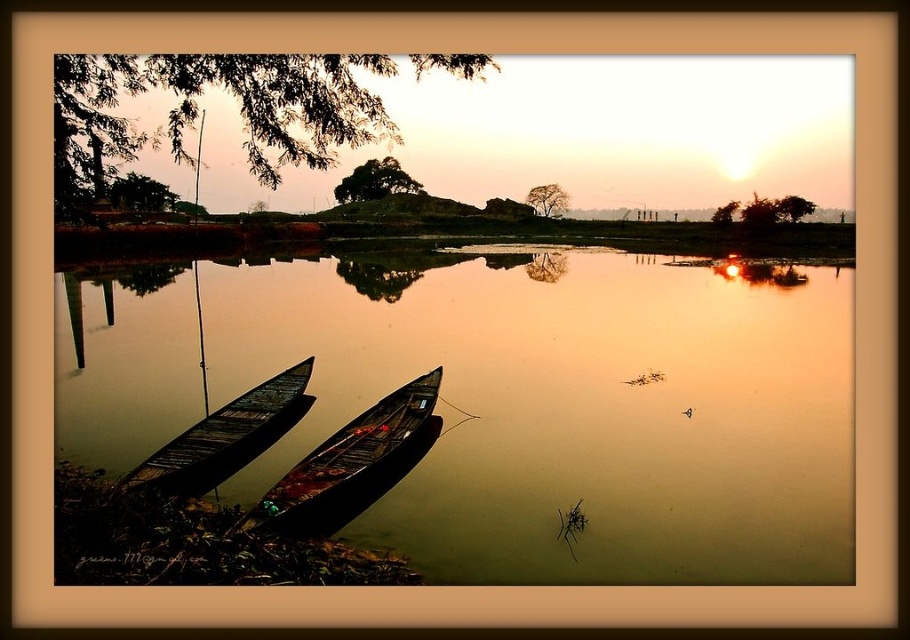
Question: Is wooden canoe at center closer to camera compared to dark wood canoe at lower left?

Choices:
 (A) yes
 (B) no

Answer: (A)

Question: Among these objects, which one is nearest to the camera?

Choices:
 (A) brown wooden river at center
 (B) dark wood canoe at lower left
 (C) wooden canoe at center

Answer: (A)

Question: Among these objects, which one is farthest from the camera?

Choices:
 (A) brown wooden river at center
 (B) wooden canoe at center

Answer: (B)

Question: Does wooden canoe at center appear under dark wood canoe at lower left?

Choices:
 (A) yes
 (B) no

Answer: (A)

Question: Is brown wooden river at center thinner than dark wood canoe at lower left?

Choices:
 (A) yes
 (B) no

Answer: (B)

Question: Which is nearer to the brown wooden river at center?

Choices:
 (A) dark wood canoe at lower left
 (B) wooden canoe at center

Answer: (B)